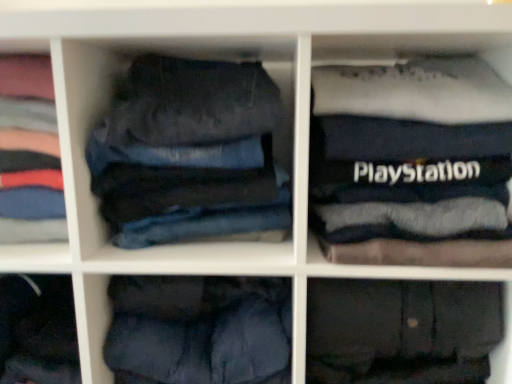
Question: From the image's perspective, is dark gray cotton trousers at lower right, marked as the third trousers in a left-to-right arrangement, over dark blue cotton trousers at lower center, the second trousers positioned from the left?

Choices:
 (A) yes
 (B) no

Answer: (B)

Question: Is dark gray cotton trousers at lower right, marked as the third trousers in a left-to-right arrangement, located outside dark blue cotton trousers at lower center, the second trousers positioned from the left?

Choices:
 (A) no
 (B) yes

Answer: (B)

Question: Does dark gray cotton trousers at lower right, the first trousers when ordered from right to left, have a lesser height compared to dark blue cotton trousers at lower center, positioned as the 2th trousers in right-to-left order?

Choices:
 (A) yes
 (B) no

Answer: (A)

Question: Is the surface of dark gray cotton trousers at lower right, the first trousers when ordered from right to left, in direct contact with dark blue cotton trousers at lower center, positioned as the 2th trousers in right-to-left order?

Choices:
 (A) no
 (B) yes

Answer: (A)

Question: Is dark blue cotton trousers at lower center, positioned as the 2th trousers in right-to-left order, surrounded by dark gray cotton trousers at lower right, the first trousers when ordered from right to left?

Choices:
 (A) yes
 (B) no

Answer: (B)

Question: Does dark gray cotton trousers at lower right, marked as the third trousers in a left-to-right arrangement, have a lesser width compared to dark blue cotton trousers at lower center, positioned as the 2th trousers in right-to-left order?

Choices:
 (A) yes
 (B) no

Answer: (B)

Question: Is dark blue cotton trousers at lower center, the second trousers positioned from the left, positioned in front of dark blue denim jeans at left, the 2th clothing from the right?

Choices:
 (A) no
 (B) yes

Answer: (B)

Question: From the image's perspective, is dark blue cotton trousers at lower center, the second trousers positioned from the left, under dark blue denim jeans at left, which is the first clothing in left-to-right order?

Choices:
 (A) yes
 (B) no

Answer: (A)

Question: Can you confirm if dark blue cotton trousers at lower center, the second trousers positioned from the left, is thinner than dark blue denim jeans at left, the 2th clothing from the right?

Choices:
 (A) no
 (B) yes

Answer: (A)

Question: Does dark blue cotton trousers at lower center, positioned as the 2th trousers in right-to-left order, have a smaller size compared to dark blue denim jeans at left, which is the first clothing in left-to-right order?

Choices:
 (A) no
 (B) yes

Answer: (A)

Question: Can you confirm if dark blue cotton trousers at lower center, positioned as the 2th trousers in right-to-left order, is positioned to the right of dark blue denim jeans at left, the 2th clothing from the right?

Choices:
 (A) no
 (B) yes

Answer: (B)

Question: Can you confirm if dark blue cotton trousers at lower center, positioned as the 2th trousers in right-to-left order, is bigger than dark blue denim jeans at left, which is the first clothing in left-to-right order?

Choices:
 (A) yes
 (B) no

Answer: (A)

Question: Can you confirm if dark blue denim jeans at left, the 2th clothing from the right, is positioned to the left of dark blue cotton trousers at lower center, the second trousers positioned from the left?

Choices:
 (A) no
 (B) yes

Answer: (B)